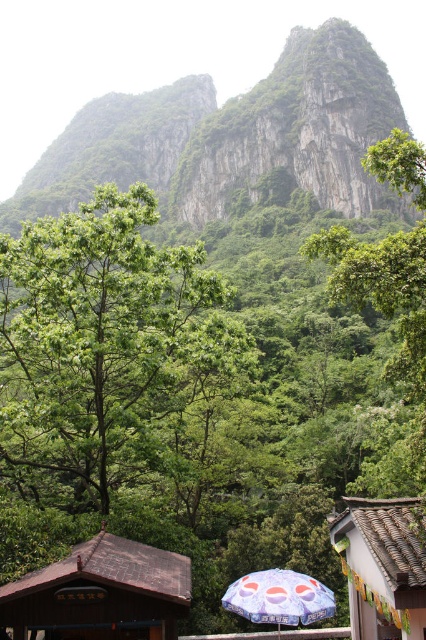
You are standing in the lush landscape and want to take a photo of both the green leafy tree at center and the brown wooden hut at lower left. Which object should you adjust your camera focus on first to ensure it appears sharp in the photo?

The green leafy tree at center is further to the viewer than the brown wooden hut at lower left, so you should focus on the green leafy tree at center first to ensure it appears sharp before the brown wooden hut at lower left.

You are a hiker who wants to take a photo of the brown wooden hut at lower left and the green leafy tree at center together in the same frame. Based on their distance, do you think you can fit both in your camera viewfinder without moving your position?

The green leafy tree at center is 6.80 meters away from the brown wooden hut at lower left. Since the distance between them is significant, you can likely fit both in the camera viewfinder without moving your position as they are not too far apart from each other.